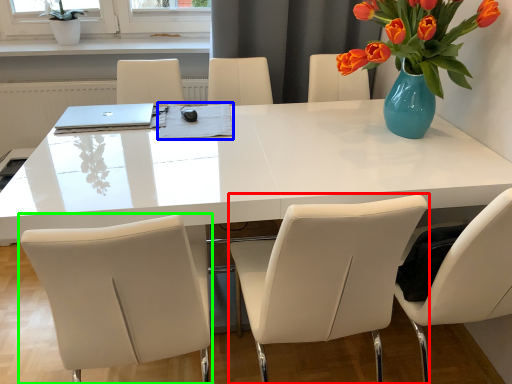
Question: Estimate the real-world distances between objects in this image. Which object is farther from chair (highlighted by a red box), notepad (highlighted by a blue box) or chair (highlighted by a green box)?

Choices:
 (A) notepad
 (B) chair

Answer: (A)